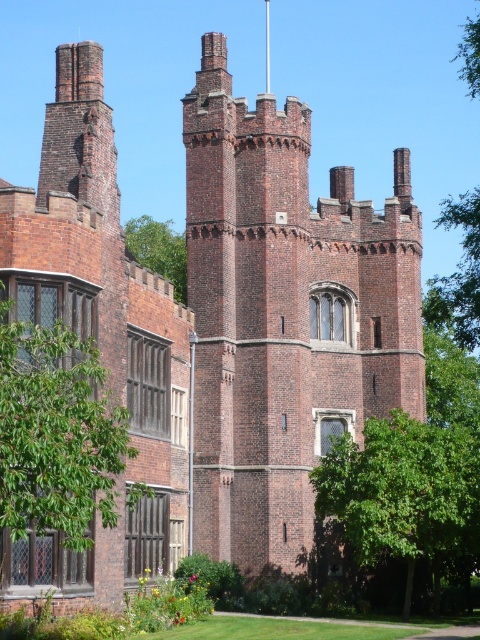
Question: Can you confirm if green leafy tree at left is smaller than green leafy tree at upper left?

Choices:
 (A) yes
 (B) no

Answer: (A)

Question: Which point is closer to the camera?

Choices:
 (A) (133, 237)
 (B) (459, 77)

Answer: (A)

Question: Does green leafy tree at left appear under green leafy tree at center?

Choices:
 (A) yes
 (B) no

Answer: (B)

Question: Which point is farther to the camera?

Choices:
 (A) (425, 316)
 (B) (346, 451)
 (C) (47, 355)

Answer: (A)

Question: Estimate the real-world distances between objects in this image. Which object is closer to the green leafy tree at center?

Choices:
 (A) green leafy tree at left
 (B) green leafy tree at upper left

Answer: (A)

Question: Is the position of green leafy tree at upper right less distant than that of green leafy tree at upper left?

Choices:
 (A) yes
 (B) no

Answer: (A)